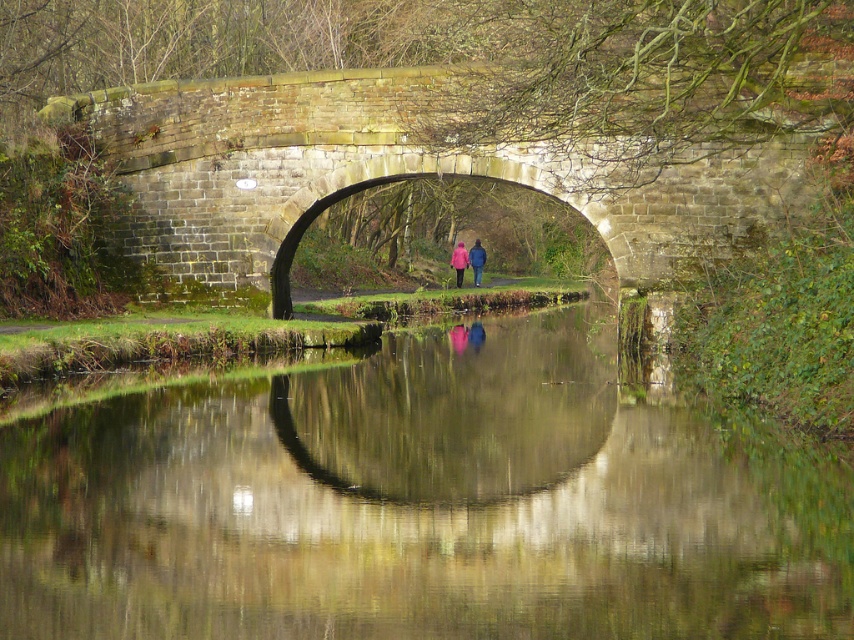
Question: Which is farther from the blue fabric jacket at center?

Choices:
 (A) stone bridge at center
 (B) matte pink coat at center
 (C) smooth reflective water at center

Answer: (C)

Question: Considering the real-world distances, which object is closest to the smooth reflective water at center?

Choices:
 (A) blue fabric jacket at center
 (B) stone bridge at center

Answer: (B)

Question: Is stone bridge at center positioned behind blue fabric jacket at center?

Choices:
 (A) yes
 (B) no

Answer: (B)

Question: Is the position of stone bridge at center less distant than that of blue fabric jacket at center?

Choices:
 (A) no
 (B) yes

Answer: (B)

Question: Can you confirm if smooth reflective water at center is smaller than blue fabric jacket at center?

Choices:
 (A) yes
 (B) no

Answer: (B)

Question: Which point appears closest to the camera in this image?

Choices:
 (A) (458, 250)
 (B) (759, 480)

Answer: (B)